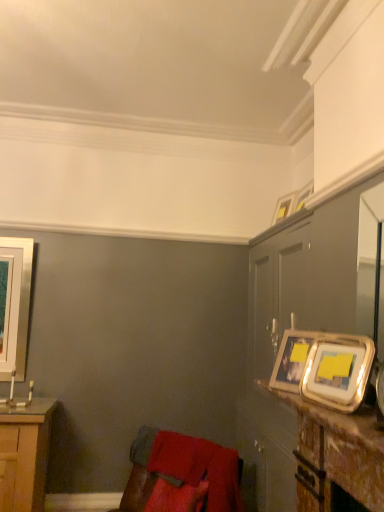
Question: Can you confirm if metallic gold frame at upper right is bigger than metallic silver picture frame at upper right, the third picture frame positioned from the back?

Choices:
 (A) no
 (B) yes

Answer: (B)

Question: Is metallic gold frame at upper right beside metallic silver picture frame at upper right, the second picture frame in the front-to-back sequence?

Choices:
 (A) no
 (B) yes

Answer: (A)

Question: From a real-world perspective, is metallic gold frame at upper right on metallic silver picture frame at upper right, acting as the 3th picture frame starting from the right?

Choices:
 (A) no
 (B) yes

Answer: (A)

Question: From the image's perspective, is metallic gold frame at upper right under metallic silver picture frame at upper right, the second picture frame in the front-to-back sequence?

Choices:
 (A) no
 (B) yes

Answer: (B)

Question: Is metallic gold frame at upper right far from metallic silver picture frame at upper right, the third picture frame positioned from the back?

Choices:
 (A) no
 (B) yes

Answer: (A)

Question: Is the depth of metallic gold frame at upper right less than that of metallic silver picture frame at upper right, acting as the 3th picture frame starting from the right?

Choices:
 (A) yes
 (B) no

Answer: (B)

Question: Considering the relative sizes of silver metallic picture frame at left, which ranks as the first picture frame in left-to-right order, and wooden table at right in the image provided, is silver metallic picture frame at left, which ranks as the first picture frame in left-to-right order, wider than wooden table at right?

Choices:
 (A) no
 (B) yes

Answer: (A)

Question: Considering the relative sizes of silver metallic picture frame at left, the 4th picture frame from the front, and wooden table at right in the image provided, is silver metallic picture frame at left, the 4th picture frame from the front, shorter than wooden table at right?

Choices:
 (A) yes
 (B) no

Answer: (B)

Question: Considering the relative positions of silver metallic picture frame at left, the 4th picture frame from the front, and wooden table at right in the image provided, is silver metallic picture frame at left, the 4th picture frame from the front, in front of wooden table at right?

Choices:
 (A) no
 (B) yes

Answer: (A)

Question: Could you tell me if silver metallic picture frame at left, which ranks as the first picture frame in left-to-right order, is turned towards wooden table at right?

Choices:
 (A) no
 (B) yes

Answer: (A)

Question: Is silver metallic picture frame at left, the first picture frame viewed from the back, surrounding wooden table at right?

Choices:
 (A) yes
 (B) no

Answer: (B)

Question: Is silver metallic picture frame at left, which ranks as the first picture frame in left-to-right order, positioned with its back to wooden table at right?

Choices:
 (A) no
 (B) yes

Answer: (A)

Question: Would you say velvet red swivel chair at lower left contains metallic silver picture frame at upper right, arranged as the 2th picture frame when viewed from the left?

Choices:
 (A) yes
 (B) no

Answer: (B)